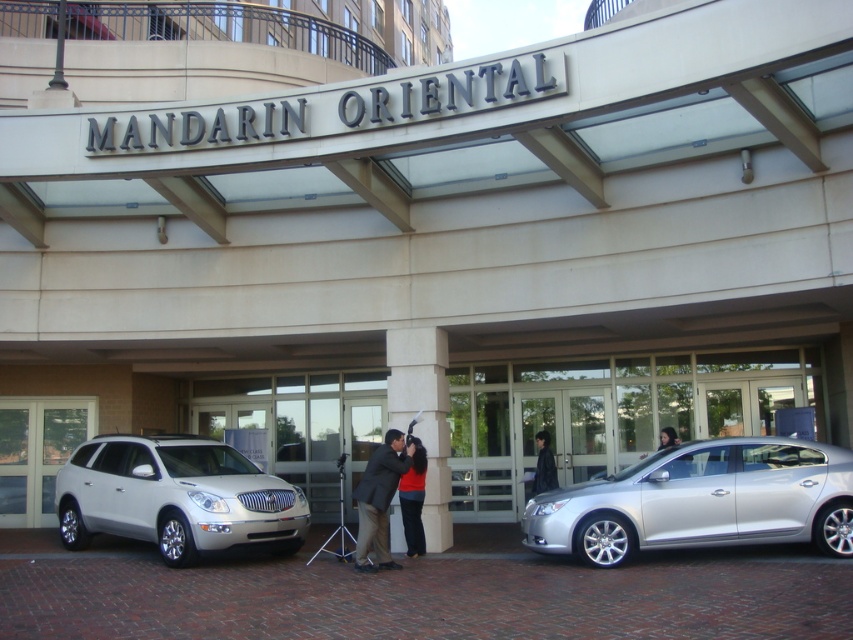
Consider the image. You are a photographer standing in front of the Mandarin Oriental hotel. You see a person wearing a matte black suit at center and another person wearing a red matte shirt at center. Which person is closer to you?

The matte black suit at center is closer to you because it is in front of the red matte shirt at center.